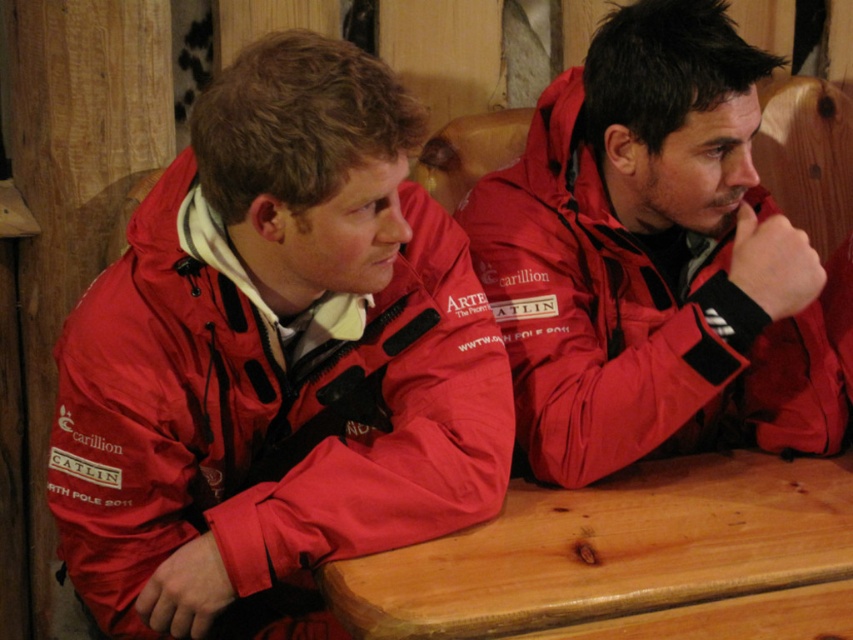
Question: Estimate the real-world distances between objects in this image. Which object is farther from the matte red jacket at center?

Choices:
 (A) wooden table at center
 (B) matte red jacket at left

Answer: (B)

Question: Which point is closer to the camera?

Choices:
 (A) (683, 477)
 (B) (154, 456)

Answer: (B)

Question: Can you confirm if matte red jacket at left is positioned to the right of wooden table at center?

Choices:
 (A) yes
 (B) no

Answer: (B)

Question: Which of the following is the closest to the observer?

Choices:
 (A) (791, 522)
 (B) (347, 554)
 (C) (738, 337)

Answer: (B)

Question: Does matte red jacket at center have a lesser width compared to wooden table at center?

Choices:
 (A) no
 (B) yes

Answer: (B)

Question: Can you confirm if matte red jacket at left is wider than wooden table at center?

Choices:
 (A) no
 (B) yes

Answer: (A)